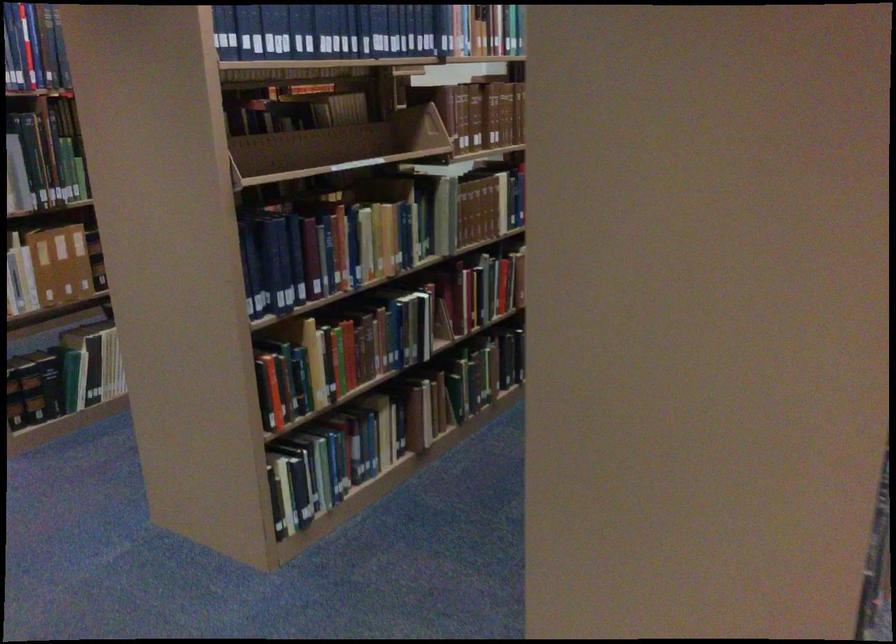
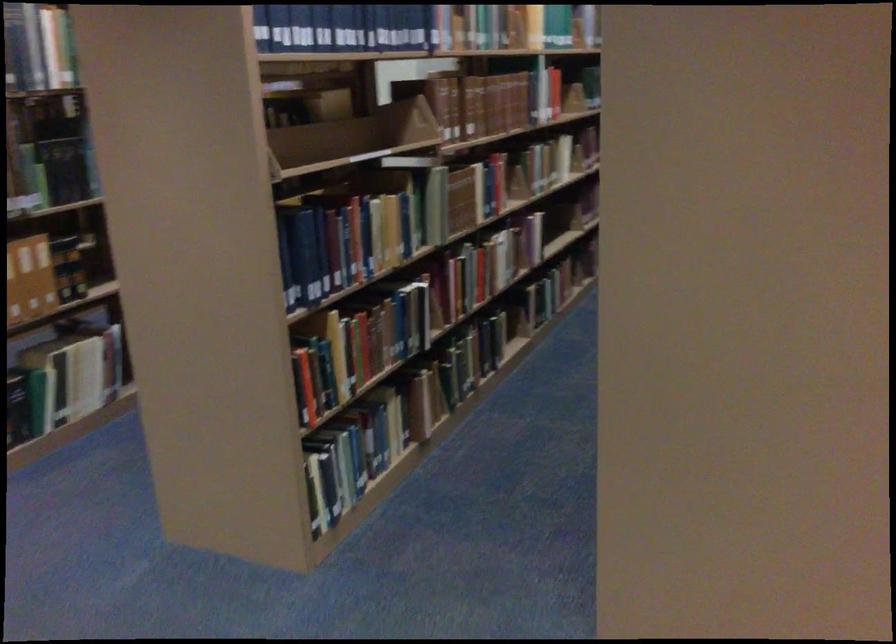
Question: Based on the continuous images, in which direction is the camera rotating? Reply with the corresponding letter.

Choices:
 (A) Left
 (B) Right
 (C) Up
 (D) Down

Answer: (B)